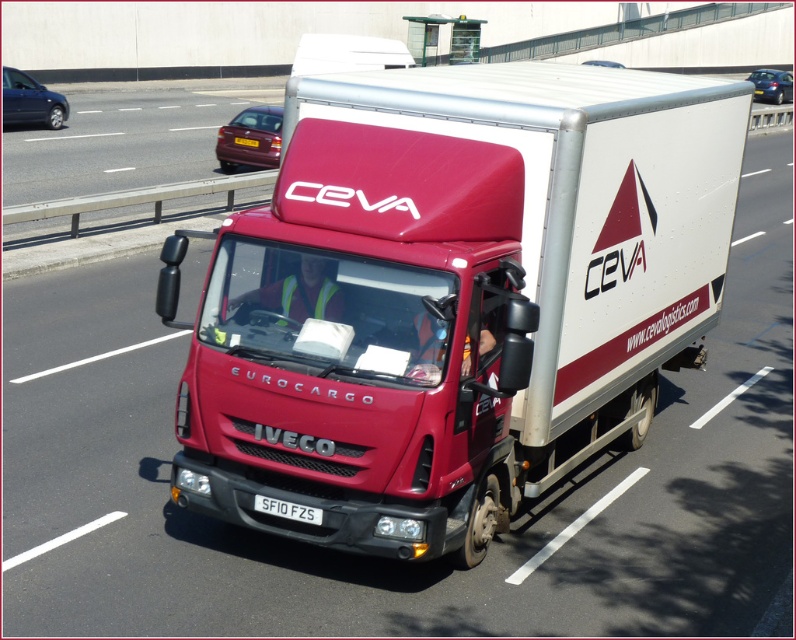
You are a pedestrian standing on the sidewalk and want to cross the road to reach a friend waiting on the other side. There is a red and white Iveco Eurocargo truck with CEVA logos driving by. The truck has two points marked at coordinates point (244, 141) and point (303, 518). Which point is closer to you as you wait on the sidewalk?

Point (244, 141) is closer to you because it is further to the viewer than point (303, 518).

What is located at the coordinates point (455,296) in the image?

The point (455,296) is occupied by the matte red trailer truck at center.

You are a traffic officer observing a road scene. You notice a shiny maroon car at upper left and a white plastic license plate at center. Which object is closer to the front of the road?

The shiny maroon car at upper left is closer to the front of the road because the white plastic license plate at center is behind it.